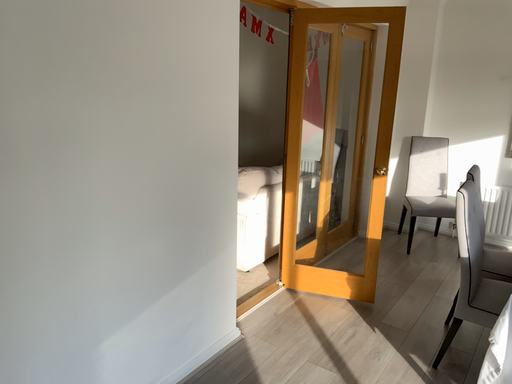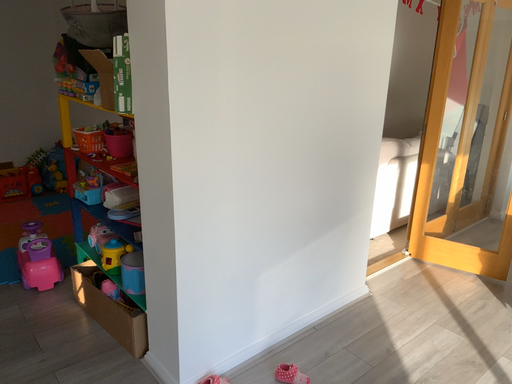
Question: How did the camera likely rotate when shooting the video?

Choices:
 (A) rotated left
 (B) rotated right

Answer: (A)